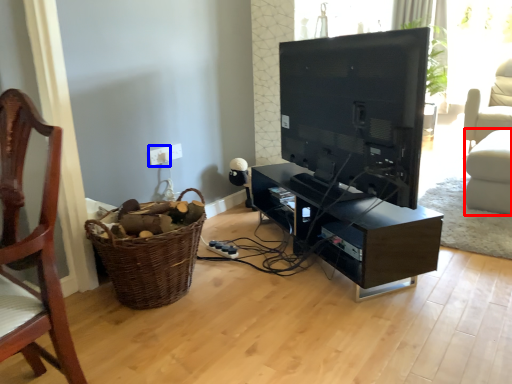
Question: Among these objects, which one is farthest to the camera, swivel chair (highlighted by a red box) or electric outlet (highlighted by a blue box)?

Choices:
 (A) swivel chair
 (B) electric outlet

Answer: (A)